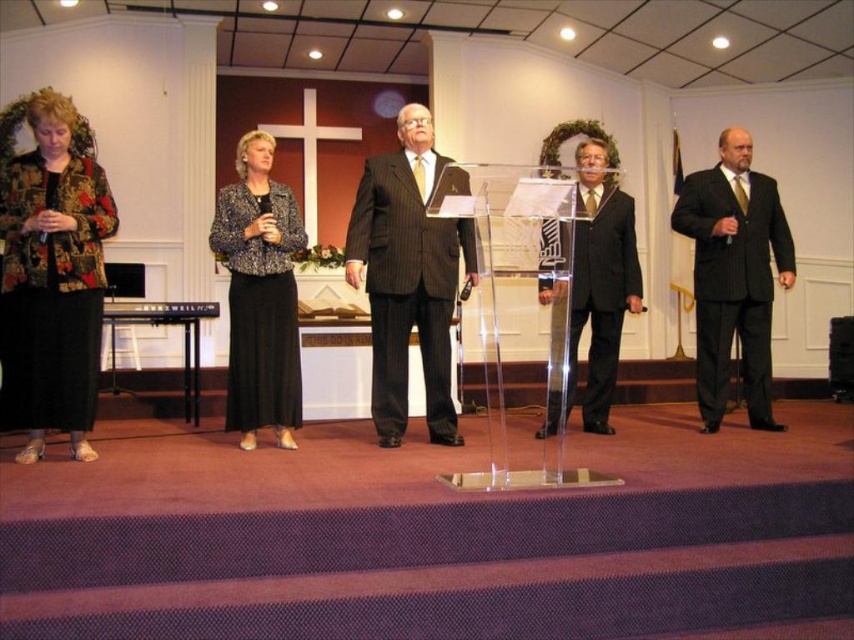
In the scene shown: You are attending the event and need to identify the speaker. The speaker is the tallest person on stage. Which of the following is the speaker? pinstriped suit at center or patterned fabric jacket at center

The pinstriped suit at center is taller than the patterned fabric jacket at center, so the speaker is the pinstriped suit at center.

You are an event planner observing the stage setup. You need to ensure that both the pinstriped suit at center and the patterned fabric jacket at center are visible to the audience. Given their widths, which one might require adjusting its position to avoid blocking the other?

The pinstriped suit at center is wider than the patterned fabric jacket at center, so adjusting the position of the pinstriped suit at center could help ensure both are visible without obstruction.

You are attending the event and want to locate the speaker who is using the podium with the paper. According to the coordinates provided, where should you look to find the pinstriped suit at center?

The pinstriped suit at center is located at coordinates point (408, 275), which is the speaker using the podium with the paper.